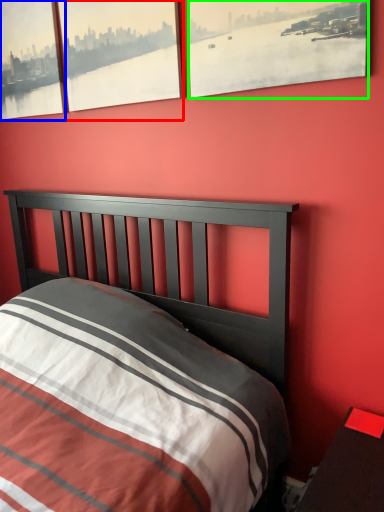
Question: Estimate the real-world distances between objects in this image. Which object is farther from window (highlighted by a red box), window (highlighted by a blue box) or window (highlighted by a green box)?

Choices:
 (A) window
 (B) window

Answer: (B)